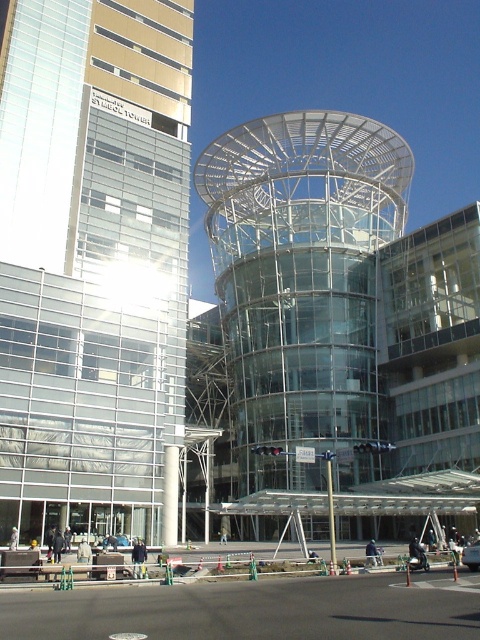
Question: Can you confirm if glassy reflective tower at left is wider than transparent glass tower at center?

Choices:
 (A) yes
 (B) no

Answer: (B)

Question: Can you confirm if glassy reflective tower at left is smaller than transparent glass tower at center?

Choices:
 (A) yes
 (B) no

Answer: (A)

Question: Which point is closer to the camera taking this photo?

Choices:
 (A) (145, 435)
 (B) (363, 202)

Answer: (A)

Question: Does glassy reflective tower at left appear over transparent glass tower at center?

Choices:
 (A) yes
 (B) no

Answer: (B)